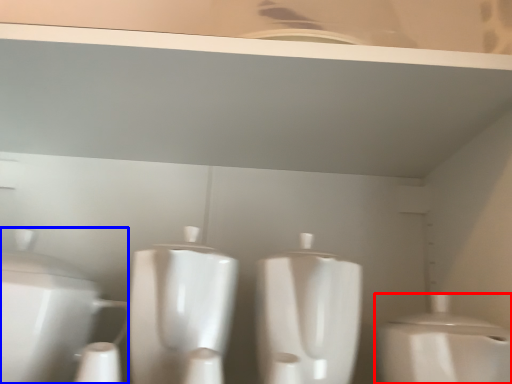
Question: Which object is further to the camera taking this photo, toilet (highlighted by a red box) or toilet (highlighted by a blue box)?

Choices:
 (A) toilet
 (B) toilet

Answer: (B)